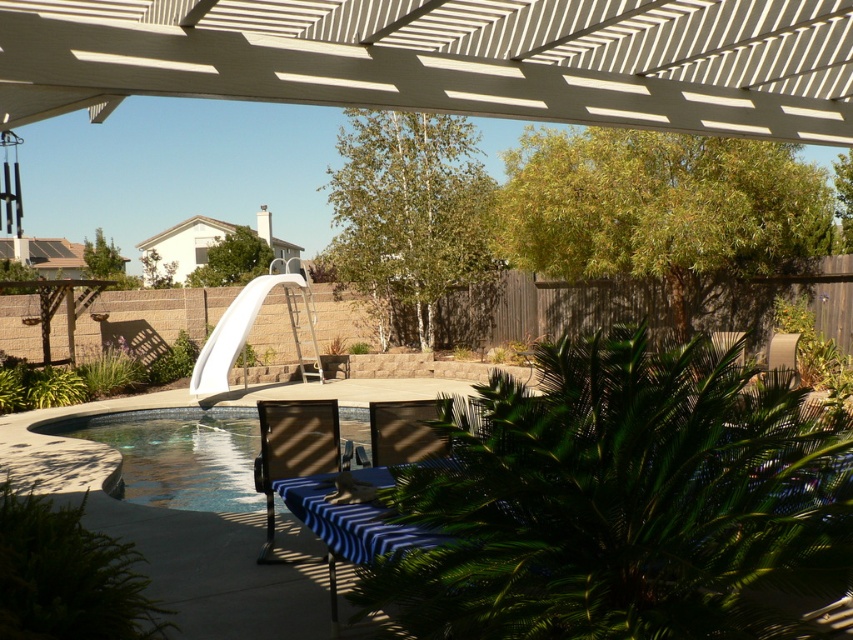
You are standing at the camera position in the backyard scene. There is a point at coordinates point (287, 282). Can you reach that point within 20 meters walking distance?

The point (287, 282) is 16.20 meters from the camera, so yes, you can reach it within 20 meters walking distance.